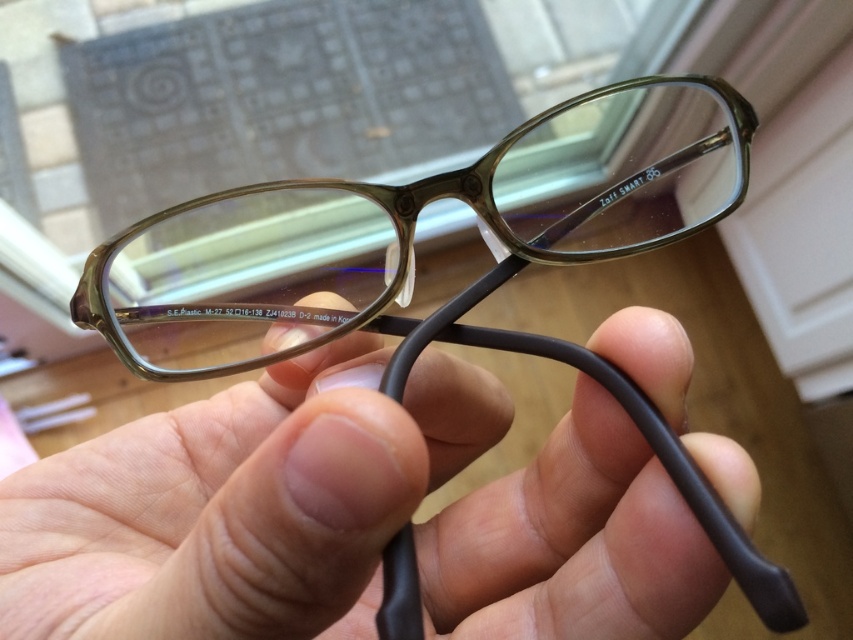
In the scene shown: You are trying to choose between two pairs of glasses displayed at a store. The matte black glasses at center and the translucent plastic glasses at center are both on the same display stand. If you want the narrower pair, which one should you pick?

The matte black glasses at center has a smaller width compared to the translucent plastic glasses at center, so you should pick the matte black glasses at center.

You are a delivery person who needs to place two pairs of glasses in a box that can only accommodate items within 15 centimeters of each other. You see the matte black glasses at center and the translucent plastic glasses at center. Can you fit both pairs into the box without exceeding the distance limit?

The distance between the matte black glasses at center and the translucent plastic glasses at center is 15.18 centimeters, which exceeds the box limit of 15 centimeters. Therefore, they cannot be placed together in the box without exceeding the distance requirement.